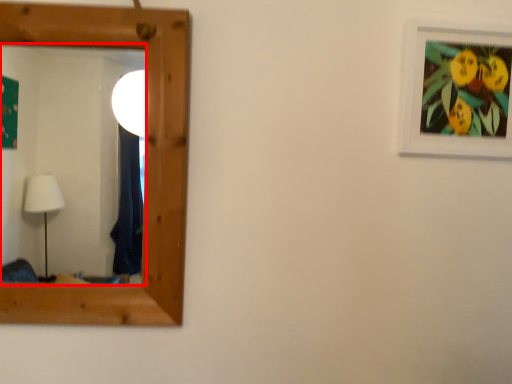
Question: Where is mirror (annotated by the red box) located in relation to picture frame in the image?

Choices:
 (A) right
 (B) left

Answer: (B)